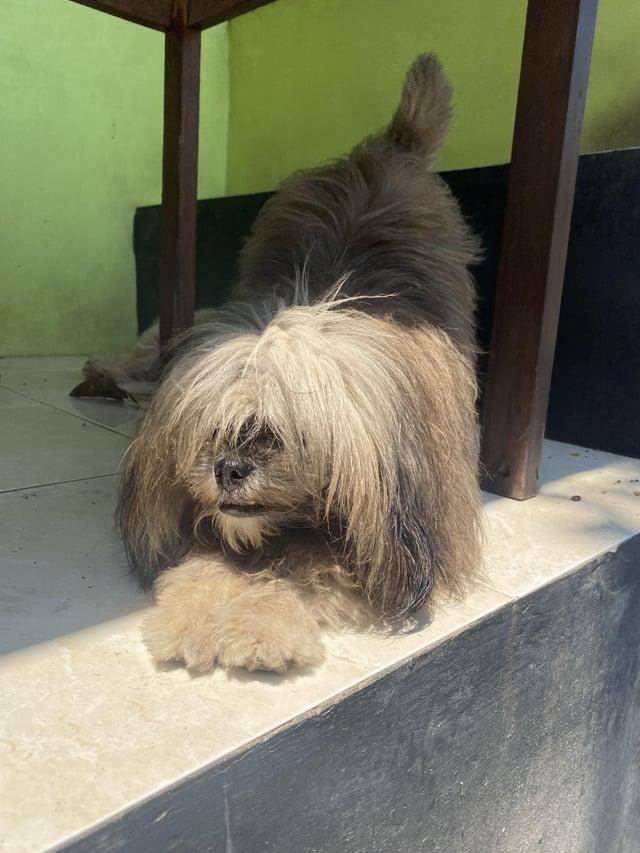
Identify the location of floor. The image size is (640, 853). (29, 703).